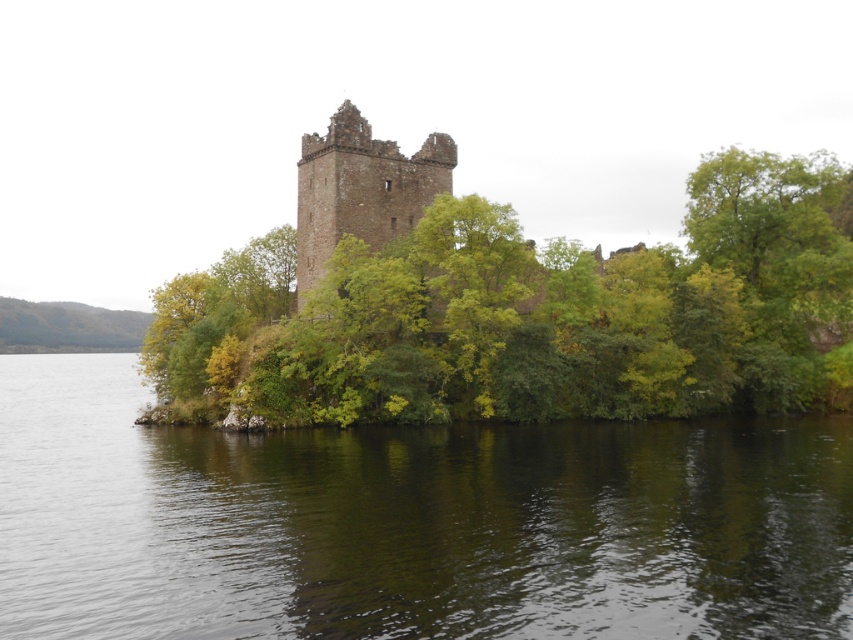
You are standing at the base of the historic stone tower and want to take a photo that includes both the point at coordinates point (762, 516) and point (436, 200). Which point should you focus on to ensure both are in sharp focus?

You should focus on point (436, 200) because it is farther from the camera than point (762, 516). By focusing on the farther point, both points will be within the depth of field and appear sharp in the photo.

You are an archaeologist examining the historic site. You notice the green leafy tree at center and the brown stone tower at center. Which object is positioned to the right side from your viewpoint?

The green leafy tree at center is positioned to the right of the brown stone tower at center, so the green leafy tree at center is on the right side.

You are a tourist standing at the edge of the dark green water at center, looking towards the brown stone tower at center. Which direction should you walk to get closer to the tower?

The dark green water at center is located below the brown stone tower at center, so you should walk upwards or towards the higher elevation to get closer to the tower.